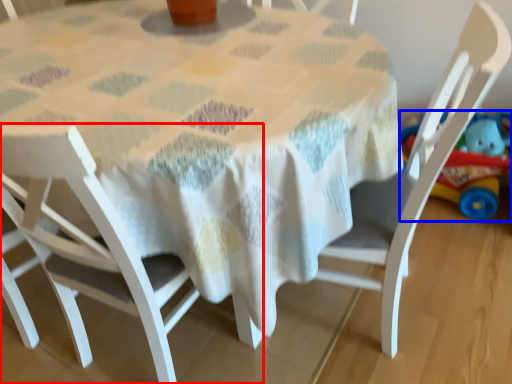
Question: Which point is closer to the camera, chair (highlighted by a red box) or toy (highlighted by a blue box)?

Choices:
 (A) chair
 (B) toy

Answer: (A)